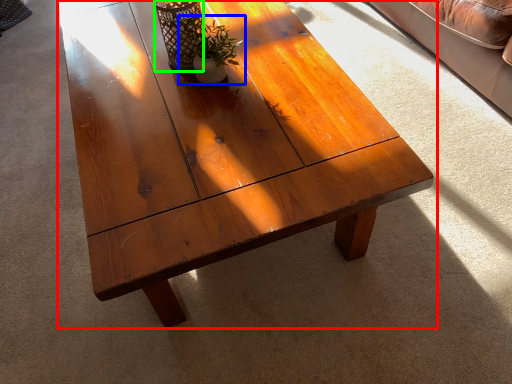
Question: Based on their relative distances, which object is nearer to coffee table (highlighted by a red box)? Choose from houseplant (highlighted by a blue box) and glass vase (highlighted by a green box).

Choices:
 (A) houseplant
 (B) glass vase

Answer: (A)